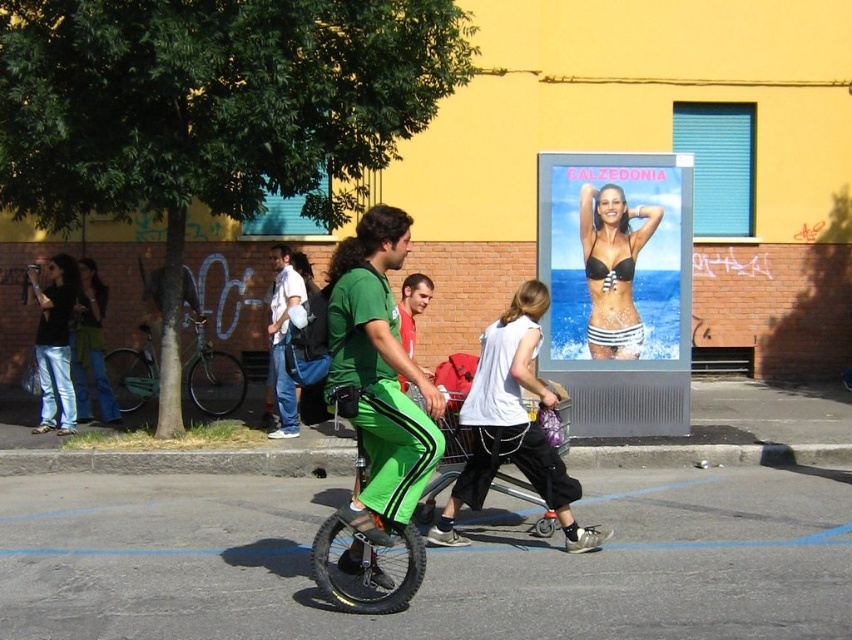
Image resolution: width=852 pixels, height=640 pixels. What do you see at coordinates (511, 426) in the screenshot? I see `white matte shirt at center` at bounding box center [511, 426].

Is point (492, 349) behind point (153, 388)?

No, it is not.

Is point (468, 422) farther from camera compared to point (142, 332)?

No, it is in front of (142, 332).

Locate an element on the screen. white matte shirt at center is located at coordinates (511, 426).

Measure the distance between green matte unicycle at center and white cotton shirt at center.

green matte unicycle at center and white cotton shirt at center are 4.99 meters apart.

Is green matte unicycle at center above white cotton shirt at center?

Incorrect, green matte unicycle at center is not positioned above white cotton shirt at center.

Between point (338, 580) and point (285, 266), which one is positioned in front?

Point (338, 580) is in front.

You are a GUI agent. You are given a task and a screenshot of the screen. Output one action in this format:
    pyautogui.click(x=<x>, y=<y>)
    Task: Click on the green matte unicycle at center
    This screenshot has width=852, height=640.
    Given the screenshot: What is the action you would take?
    click(366, 564)

Is green matte pants at center above black bikini at center?

Actually, green matte pants at center is below black bikini at center.

Is point (389, 230) positioned behind point (619, 268)?

No, it is not.

Image resolution: width=852 pixels, height=640 pixels. What are the coordinates of `green matte pants at center` in the screenshot? It's located at (378, 376).